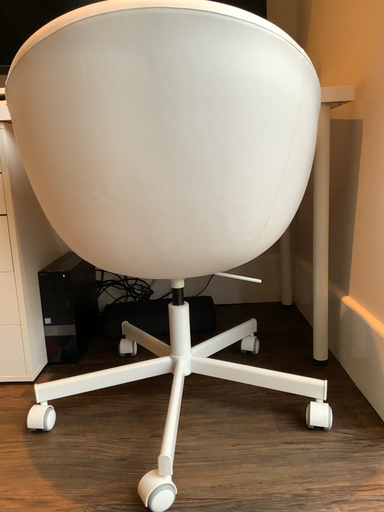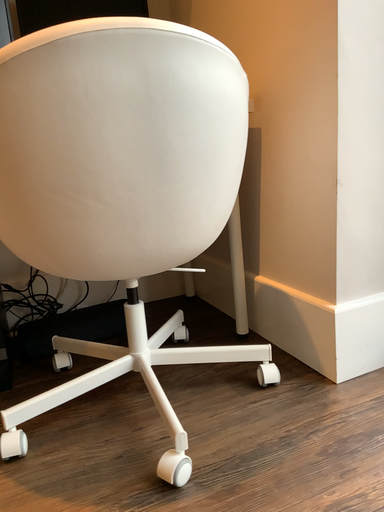
Question: How did the camera likely rotate when shooting the video?

Choices:
 (A) rotated left
 (B) rotated right

Answer: (B)